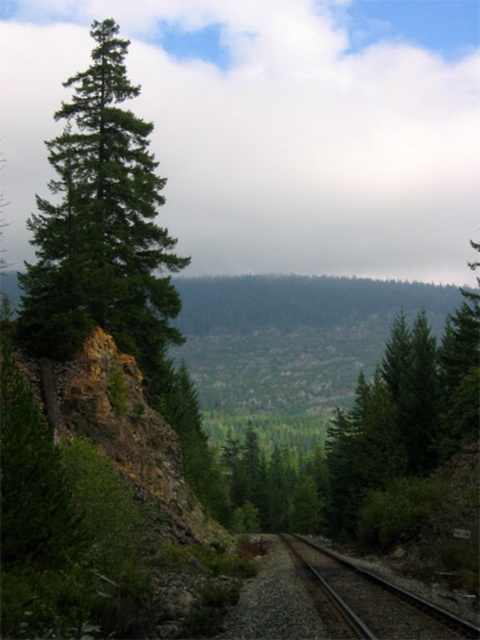
Which of these two, green matte tree at left or black metal train track at center, stands taller?

Standing taller between the two is green matte tree at left.

Consider the image. Between green matte tree at left and black metal train track at center, which one appears on the left side from the viewer's perspective?

green matte tree at left is more to the left.

At what (x,y) coordinates should I click in order to perform the action: click on green matte tree at left. Please return your answer as a coordinate pair (x, y). This screenshot has width=480, height=640. Looking at the image, I should click on (100, 224).

Locate an element on the screen. This screenshot has height=640, width=480. green matte tree at left is located at coordinates (100, 224).